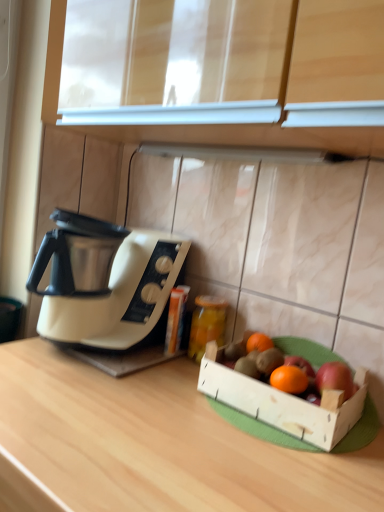
Question: Can you confirm if white plastic coffee maker at left is shorter than wooden at center?

Choices:
 (A) no
 (B) yes

Answer: (B)

Question: Is white plastic coffee maker at left far away from wooden at center?

Choices:
 (A) no
 (B) yes

Answer: (A)

Question: Is white plastic coffee maker at left to the right of wooden at center from the viewer's perspective?

Choices:
 (A) no
 (B) yes

Answer: (A)

Question: Considering the relative sizes of white plastic coffee maker at left and wooden at center in the image provided, is white plastic coffee maker at left bigger than wooden at center?

Choices:
 (A) yes
 (B) no

Answer: (B)

Question: Is wooden at center inside white plastic coffee maker at left?

Choices:
 (A) no
 (B) yes

Answer: (A)

Question: Considering the positions of red matte apple at right and orange matte grapefruit at center, the 2th grapefruit from the back, in the image, is red matte apple at right bigger or smaller than orange matte grapefruit at center, the 2th grapefruit from the back,?

Choices:
 (A) small
 (B) big

Answer: (B)

Question: From a real-world perspective, is red matte apple at right above or below orange matte grapefruit at center, the first grapefruit when ordered from front to back?

Choices:
 (A) above
 (B) below

Answer: (A)

Question: Is red matte apple at right wider or thinner than orange matte grapefruit at center, the first grapefruit when ordered from front to back?

Choices:
 (A) wide
 (B) thin

Answer: (A)

Question: Visually, is red matte apple at right positioned to the left or to the right of orange matte grapefruit at center, the first grapefruit when ordered from front to back?

Choices:
 (A) left
 (B) right

Answer: (B)

Question: Would you say white glossy exhaust hood at center is to the left or to the right of translucent glass jar at center in the picture?

Choices:
 (A) right
 (B) left

Answer: (A)

Question: From the image's perspective, is white glossy exhaust hood at center above or below translucent glass jar at center?

Choices:
 (A) above
 (B) below

Answer: (A)

Question: Is white glossy exhaust hood at center inside or outside of translucent glass jar at center?

Choices:
 (A) outside
 (B) inside

Answer: (A)

Question: In terms of height, does white glossy exhaust hood at center look taller or shorter compared to translucent glass jar at center?

Choices:
 (A) tall
 (B) short

Answer: (B)

Question: In terms of height, does orange matte grapefruit at center, marked as the first grapefruit in a back-to-front arrangement, look taller or shorter compared to orange matte grapefruit at center, the first grapefruit when ordered from front to back?

Choices:
 (A) tall
 (B) short

Answer: (A)

Question: Based on their positions, is orange matte grapefruit at center, marked as the first grapefruit in a back-to-front arrangement, located to the left or right of orange matte grapefruit at center, the first grapefruit when ordered from front to back?

Choices:
 (A) left
 (B) right

Answer: (A)